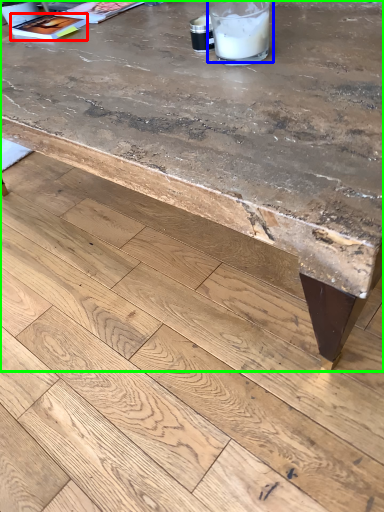
Question: Estimate the real-world distances between objects in this image. Which object is farther from magazine (highlighted by a red box), drinking straw (highlighted by a blue box) or table (highlighted by a green box)?

Choices:
 (A) drinking straw
 (B) table

Answer: (B)